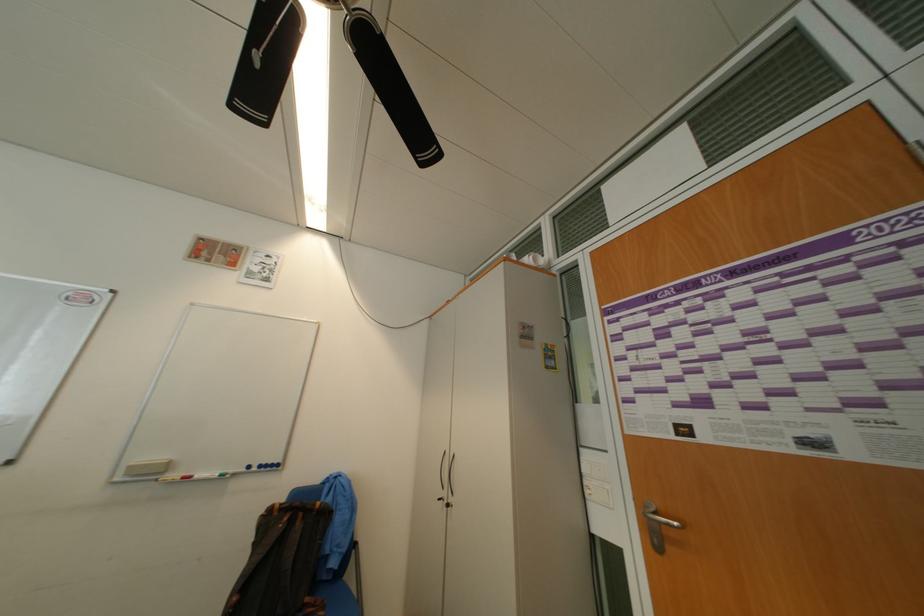
What do you see at coordinates (337, 598) in the screenshot?
I see `the blue chair sitting surface` at bounding box center [337, 598].